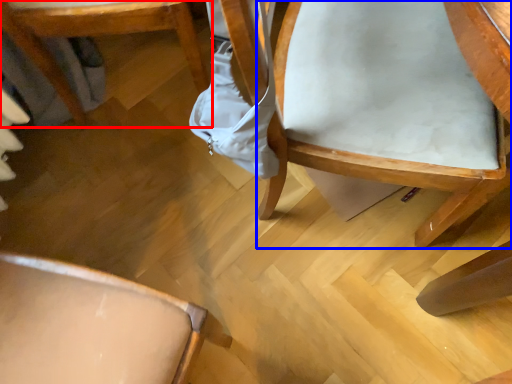
Question: Which object appears closest to the camera in this image, chair (highlighted by a red box) or chair (highlighted by a blue box)?

Choices:
 (A) chair
 (B) chair

Answer: (B)